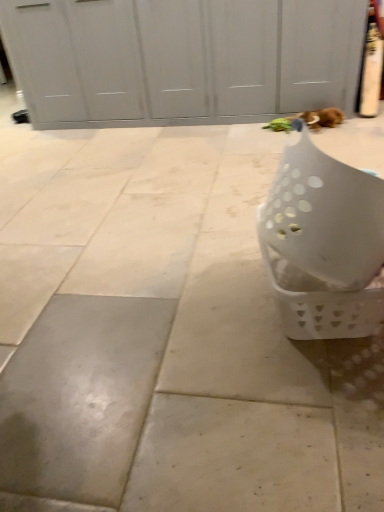
Find the location of `free space in front of brown plush cat at upper right`. free space in front of brown plush cat at upper right is located at coordinates pos(339,136).